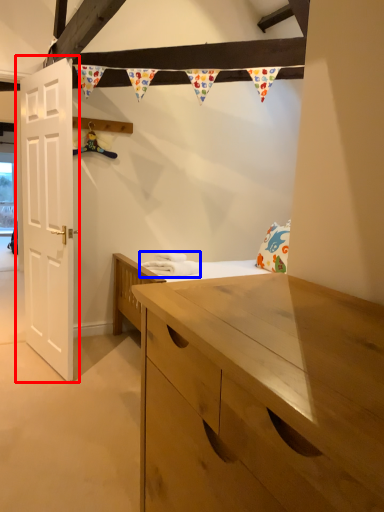
Question: Which point is closer to the camera, door (highlighted by a red box) or laundry (highlighted by a blue box)?

Choices:
 (A) door
 (B) laundry

Answer: (A)